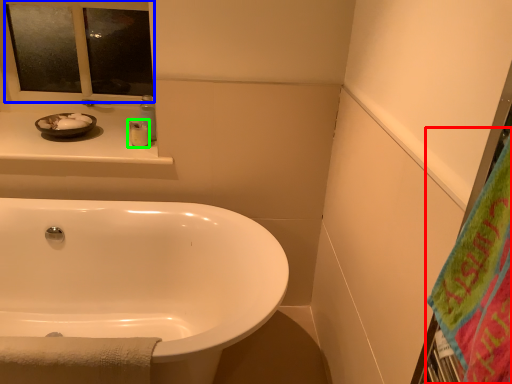
Question: Considering the real-world distances, which object is closest to beach towel (highlighted by a red box)? mirror (highlighted by a blue box) or toiletry (highlighted by a green box).

Choices:
 (A) mirror
 (B) toiletry

Answer: (B)